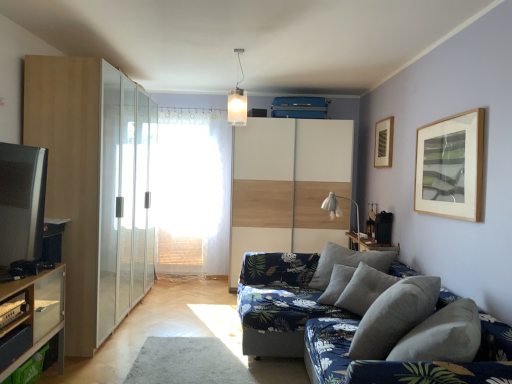
Question: Considering the relative sizes of white glass pendant light at upper center and transparent glass screen door at left in the image provided, is white glass pendant light at upper center smaller than transparent glass screen door at left?

Choices:
 (A) no
 (B) yes

Answer: (B)

Question: From the image's perspective, is white glass pendant light at upper center below transparent glass screen door at left?

Choices:
 (A) yes
 (B) no

Answer: (B)

Question: Can you confirm if white glass pendant light at upper center is shorter than transparent glass screen door at left?

Choices:
 (A) yes
 (B) no

Answer: (A)

Question: Is white glass pendant light at upper center to the left of transparent glass screen door at left from the viewer's perspective?

Choices:
 (A) no
 (B) yes

Answer: (A)

Question: Is white glass pendant light at upper center at the right side of transparent glass screen door at left?

Choices:
 (A) yes
 (B) no

Answer: (A)

Question: Based on their positions, is blue floral fabric couch at lower right located to the left or right of white wood dresser at center, positioned as the second dresser in front-to-back order?

Choices:
 (A) left
 (B) right

Answer: (B)

Question: Is blue floral fabric couch at lower right situated inside white wood dresser at center, positioned as the second dresser in front-to-back order, or outside?

Choices:
 (A) outside
 (B) inside

Answer: (A)

Question: From a real-world perspective, relative to white wood dresser at center, positioned as the second dresser in front-to-back order, is blue floral fabric couch at lower right vertically above or below?

Choices:
 (A) above
 (B) below

Answer: (B)

Question: Looking at their shapes, would you say blue floral fabric couch at lower right is wider or thinner than white wood dresser at center, marked as the 1th dresser in a back-to-front arrangement?

Choices:
 (A) thin
 (B) wide

Answer: (B)

Question: From a real-world perspective, is wooden shelf at lower left positioned above or below gray fabric pillow at lower right?

Choices:
 (A) below
 (B) above

Answer: (A)

Question: In the image, is wooden shelf at lower left positioned in front of or behind gray fabric pillow at lower right?

Choices:
 (A) behind
 (B) front

Answer: (B)

Question: Is wooden shelf at lower left to the left or to the right of gray fabric pillow at lower right in the image?

Choices:
 (A) left
 (B) right

Answer: (A)

Question: Considering the positions of wooden shelf at lower left and gray fabric pillow at lower right in the image, is wooden shelf at lower left wider or thinner than gray fabric pillow at lower right?

Choices:
 (A) wide
 (B) thin

Answer: (A)

Question: From the image's perspective, is white wood dresser at center, positioned as the second dresser in front-to-back order, above or below wooden framed artwork at upper right?

Choices:
 (A) above
 (B) below

Answer: (B)

Question: Is point (348, 165) closer or farther from the camera than point (392, 142)?

Choices:
 (A) closer
 (B) farther

Answer: (B)